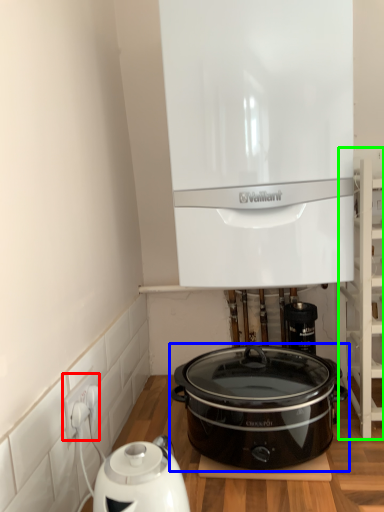
Question: Considering the real-world distances, which object is farthest from electric outlet (highlighted by a red box)? slow cooker (highlighted by a blue box) or shelf (highlighted by a green box)?

Choices:
 (A) slow cooker
 (B) shelf

Answer: (B)